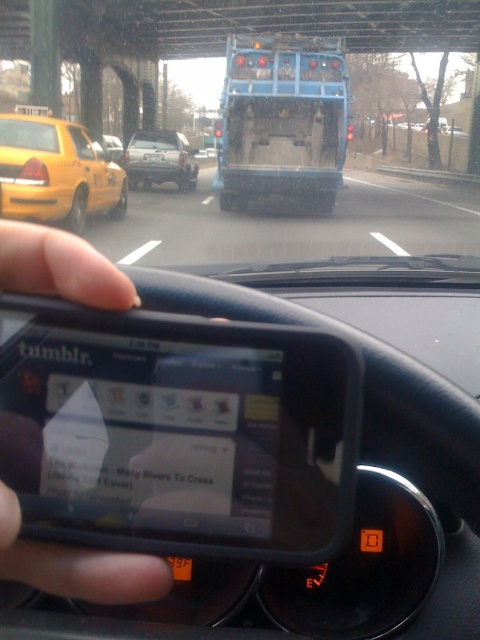
You are inside a car looking through the windshield. You notice two points in the scene, one at coordinates point (113, 296) and another at point (156, 164). Which point is nearer to you?

Point (113, 296) is closer to the camera than point (156, 164), so the point at coordinates point (113, 296) is nearer to you.

You are a delivery driver who needs to turn left onto a side street ahead. The yellow matte taxi at left is blocking your path. Can you safely navigate around it without crossing into oncoming traffic?

The yellow matte taxi at left is positioned at coordinates (56, 172), which suggests it is near the left edge of the road. Since you need to turn left, you can safely move around it by staying in your lane and ensuring there is enough space to maneuver without crossing into oncoming traffic.